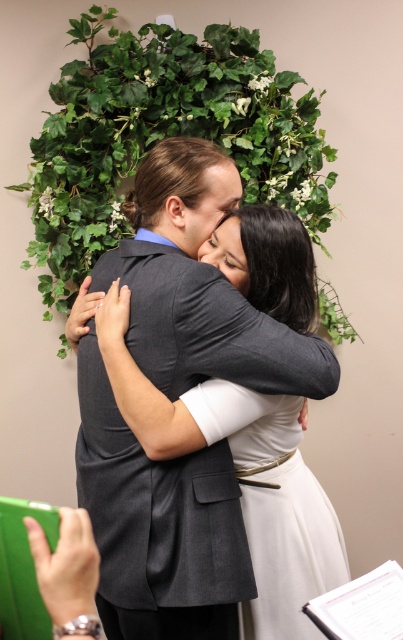
Question: Does dark gray suit at center have a larger size compared to green leafy ivy at upper center?

Choices:
 (A) no
 (B) yes

Answer: (A)

Question: Can you confirm if dark gray suit at center is thinner than green leafy ivy at upper center?

Choices:
 (A) no
 (B) yes

Answer: (B)

Question: Which of the following is the farthest from the observer?

Choices:
 (A) green leafy ivy at upper center
 (B) dark gray suit at center

Answer: (A)

Question: Can you confirm if dark gray suit at center is thinner than green leafy ivy at upper center?

Choices:
 (A) no
 (B) yes

Answer: (B)